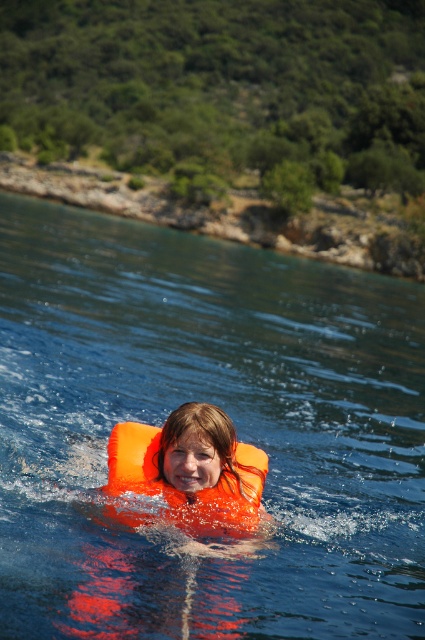
Question: Can you confirm if transparent orange life vest at center is positioned to the left of orange inflatable at center?

Choices:
 (A) no
 (B) yes

Answer: (B)

Question: Which point is closer to the camera?

Choices:
 (A) (121, 477)
 (B) (204, 260)

Answer: (A)

Question: Among these objects, which one is nearest to the camera?

Choices:
 (A) transparent orange life vest at center
 (B) orange inflatable at center

Answer: (A)

Question: Can you confirm if transparent orange life vest at center is smaller than orange inflatable at center?

Choices:
 (A) yes
 (B) no

Answer: (B)

Question: Can you confirm if transparent orange life vest at center is bigger than orange inflatable at center?

Choices:
 (A) no
 (B) yes

Answer: (B)